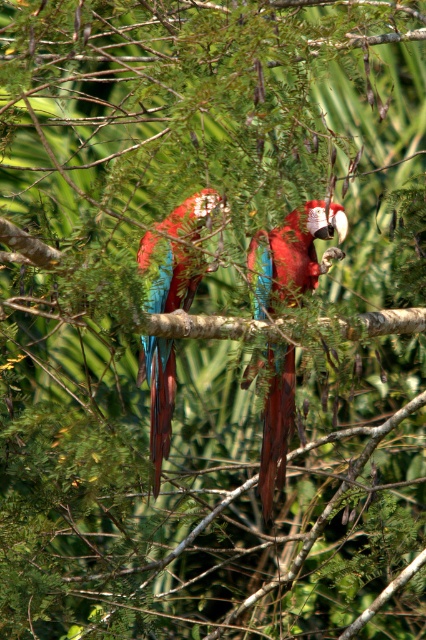
Can you confirm if shiny metallic parrot at center is positioned to the right of glossy metallic parrot at center?

Indeed, shiny metallic parrot at center is positioned on the right side of glossy metallic parrot at center.

Is shiny metallic parrot at center smaller than glossy metallic parrot at center?

Incorrect, shiny metallic parrot at center is not smaller in size than glossy metallic parrot at center.

Between point (264, 513) and point (143, 241), which one is positioned behind?

The point (264, 513) is more distant.

At what (x,y) coordinates should I click in order to perform the action: click on shiny metallic parrot at center. Please return your answer as a coordinate pair (x, y). Image resolution: width=426 pixels, height=640 pixels. Looking at the image, I should click on (293, 253).